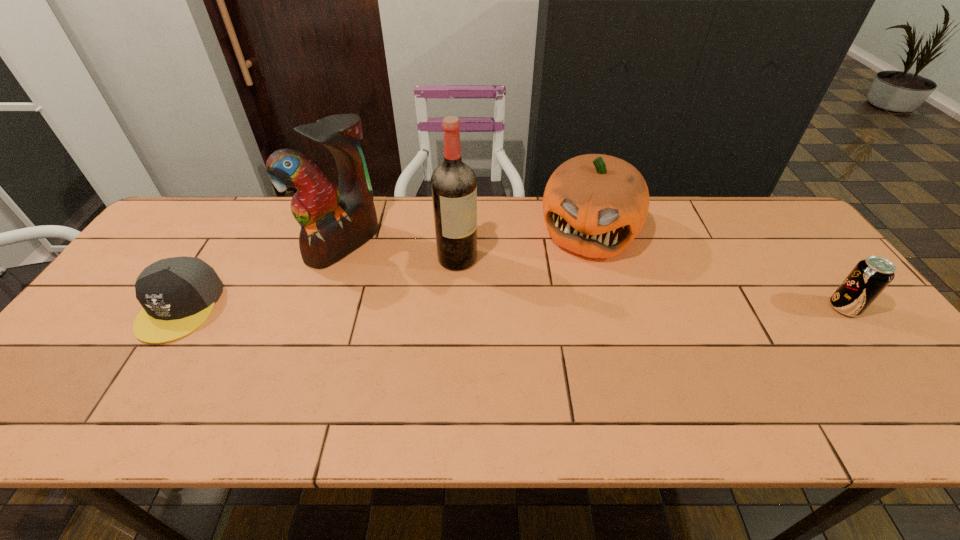
What are the coordinates of `unoccupied position between the third tallest object and the liquor` in the screenshot? It's located at (523, 245).

Find the location of a particular element. The height and width of the screenshot is (540, 960). free space between the shortest object and the third object from right to left is located at coordinates (319, 282).

Locate an element on the screen. The width and height of the screenshot is (960, 540). free point between the pumpkin and the fourth tallest object is located at coordinates (716, 269).

At what (x,y) coordinates should I click in order to perform the action: click on free spot between the soda can and the pumpkin. Please return your answer as a coordinate pair (x, y). Looking at the image, I should click on (716, 269).

Identify the location of free space between the fourth object from right to left and the third object from left to right. (400, 251).

Find the location of a particular element. The width and height of the screenshot is (960, 540). object that is the second nearest to the leftmost object is located at coordinates (454, 184).

Where is `the fourth closest object relative to the rightmost object`? This screenshot has height=540, width=960. the fourth closest object relative to the rightmost object is located at coordinates (178, 294).

Identify the location of free spot that satisfies the following two spatial constraints: 1. on the front-facing side of the soda can; 2. on the left side of the leftmost object. pyautogui.click(x=180, y=308).

Where is `blank space that satisfies the following two spatial constraints: 1. on the back side of the third shortest object; 2. on the right side of the second tallest object`? blank space that satisfies the following two spatial constraints: 1. on the back side of the third shortest object; 2. on the right side of the second tallest object is located at coordinates (348, 232).